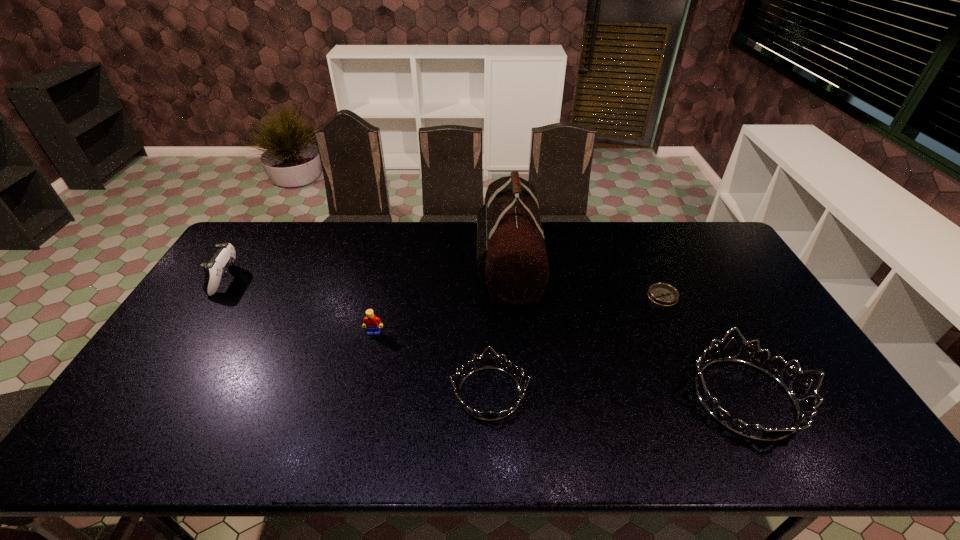
Locate an element on the screen. the shorter tiara is located at coordinates (489, 362).

Locate an element on the screen. The image size is (960, 540). the left tiara is located at coordinates (489, 362).

Locate an element on the screen. Image resolution: width=960 pixels, height=540 pixels. the taller tiara is located at coordinates (797, 389).

Image resolution: width=960 pixels, height=540 pixels. In order to click on duffel bag in this screenshot , I will do `click(511, 254)`.

The width and height of the screenshot is (960, 540). What are the coordinates of `Lego` in the screenshot? It's located at (370, 321).

Where is `the second object from left to right`? This screenshot has width=960, height=540. the second object from left to right is located at coordinates pyautogui.click(x=370, y=321).

You are a GUI agent. You are given a task and a screenshot of the screen. Output one action in this format:
    pyautogui.click(x=<x>, y=<y>)
    Task: Click on the leftmost object
    The height and width of the screenshot is (540, 960).
    Given the screenshot: What is the action you would take?
    pyautogui.click(x=217, y=268)

Find the location of a particular element. This screenshot has height=540, width=960. the shortest object is located at coordinates (663, 294).

Where is `vacant space located 0.300m on the front-facing side of the right tiara`? The width and height of the screenshot is (960, 540). vacant space located 0.300m on the front-facing side of the right tiara is located at coordinates (566, 398).

Locate an element on the screen. The image size is (960, 540). vacant space located 0.260m on the front-facing side of the right tiara is located at coordinates (583, 398).